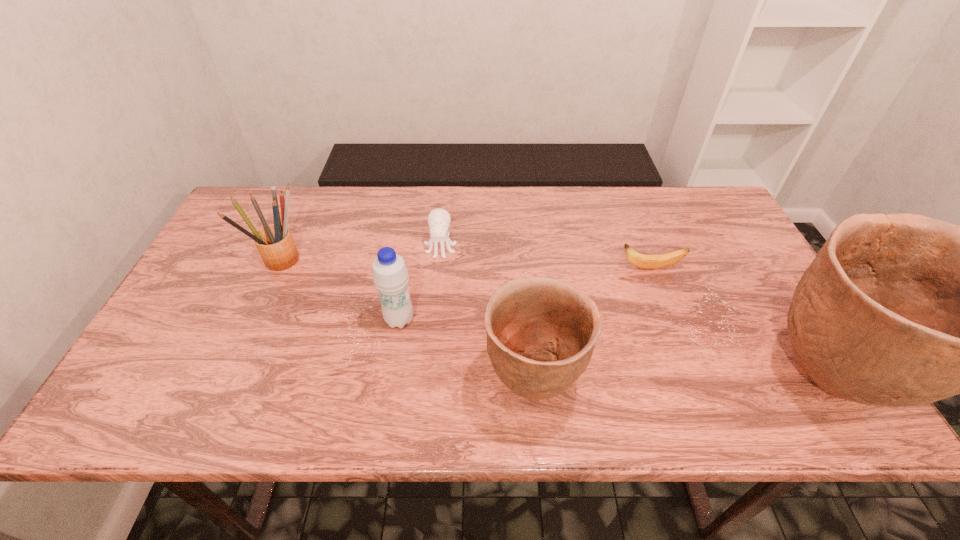
Where is `the shorter pottery`? the shorter pottery is located at coordinates 541,332.

Locate an element on the screen. This screenshot has height=540, width=960. the left pottery is located at coordinates (541, 332).

What are the coordinates of `the taller pottery` in the screenshot? It's located at (896, 310).

Locate an element on the screen. the right pottery is located at coordinates (896, 310).

At what (x,y) coordinates should I click in order to perform the action: click on octopus. Please return your answer as a coordinate pair (x, y). Looking at the image, I should click on (439, 220).

Identify the location of banana. The width and height of the screenshot is (960, 540). (640, 260).

The width and height of the screenshot is (960, 540). Identify the location of the shortest object. (640, 260).

What are the coordinates of `water bottle` in the screenshot? It's located at (390, 275).

Identify the location of the leftmost object. This screenshot has height=540, width=960. (274, 242).

I want to click on vacant position located on the back of the shorter pottery, so click(x=521, y=262).